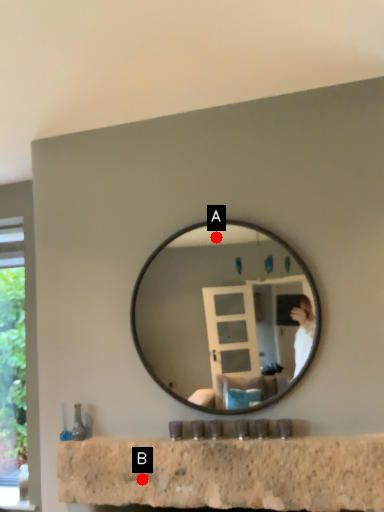
Question: Two points are circled on the image, labeled by A and B beside each circle. Which point is closer to the camera?

Choices:
 (A) A is closer
 (B) B is closer

Answer: (B)